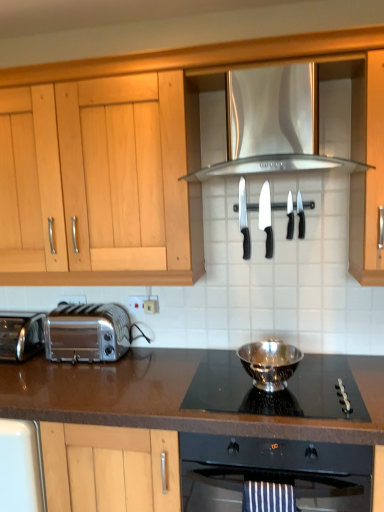
Question: From the image's perspective, is white plastic electric outlet at lower center, positioned as the first electric outlet in right-to-left order, below black plastic knife at center, the second knife viewed from the left?

Choices:
 (A) no
 (B) yes

Answer: (B)

Question: Are white plastic electric outlet at lower center, which appears as the 1th electric outlet when viewed from the front, and black plastic knife at center, the second knife viewed from the left, located far from each other?

Choices:
 (A) yes
 (B) no

Answer: (B)

Question: From a real-world perspective, is white plastic electric outlet at lower center, arranged as the second electric outlet when viewed from the left, on top of black plastic knife at center, the second knife viewed from the left?

Choices:
 (A) no
 (B) yes

Answer: (A)

Question: Considering the relative positions of white plastic electric outlet at lower center, the 2th electric outlet viewed from the back, and black plastic knife at center, the 3th knife from the right, in the image provided, is white plastic electric outlet at lower center, the 2th electric outlet viewed from the back, to the right of black plastic knife at center, the 3th knife from the right, from the viewer's perspective?

Choices:
 (A) yes
 (B) no

Answer: (B)

Question: Can you confirm if white plastic electric outlet at lower center, the 2th electric outlet viewed from the back, is thinner than black plastic knife at center, the 3th knife from the right?

Choices:
 (A) yes
 (B) no

Answer: (A)

Question: Considering the positions of silver metallic bowl at center and polished stainless steel bowl at center in the image, is silver metallic bowl at center bigger or smaller than polished stainless steel bowl at center?

Choices:
 (A) small
 (B) big

Answer: (B)

Question: In the image, is silver metallic bowl at center positioned in front of or behind polished stainless steel bowl at center?

Choices:
 (A) behind
 (B) front

Answer: (B)

Question: Is silver metallic bowl at center spatially inside polished stainless steel bowl at center, or outside of it?

Choices:
 (A) inside
 (B) outside

Answer: (B)

Question: In terms of width, does silver metallic bowl at center look wider or thinner when compared to polished stainless steel bowl at center?

Choices:
 (A) wide
 (B) thin

Answer: (A)

Question: Considering the relative positions of white plastic electric outlet at center, the first electric outlet in the back-to-front sequence, and silver metallic toaster at lower left, which is counted as the 2th toaster, starting from the right, in the image provided, is white plastic electric outlet at center, the first electric outlet in the back-to-front sequence, to the left or to the right of silver metallic toaster at lower left, which is counted as the 2th toaster, starting from the right,?

Choices:
 (A) right
 (B) left

Answer: (A)

Question: Considering the positions of white plastic electric outlet at center, positioned as the 2th electric outlet in front-to-back order, and silver metallic toaster at lower left, which is counted as the 2th toaster, starting from the right, in the image, is white plastic electric outlet at center, positioned as the 2th electric outlet in front-to-back order, taller or shorter than silver metallic toaster at lower left, which is counted as the 2th toaster, starting from the right,?

Choices:
 (A) tall
 (B) short

Answer: (B)

Question: From the image's perspective, relative to silver metallic toaster at lower left, which appears as the first toaster when viewed from the left, is white plastic electric outlet at center, the first electric outlet in the back-to-front sequence, above or below?

Choices:
 (A) above
 (B) below

Answer: (A)

Question: From a real-world perspective, relative to silver metallic toaster at lower left, which is counted as the 2th toaster, starting from the right, is white plastic electric outlet at center, the first electric outlet in the back-to-front sequence, vertically above or below?

Choices:
 (A) below
 (B) above

Answer: (B)

Question: Considering the positions of shiny metallic toaster at left, arranged as the first toaster when viewed from the right, and silver metallic toaster at lower left, which appears as the first toaster when viewed from the left, in the image, is shiny metallic toaster at left, arranged as the first toaster when viewed from the right, taller or shorter than silver metallic toaster at lower left, which appears as the first toaster when viewed from the left,?

Choices:
 (A) tall
 (B) short

Answer: (A)

Question: Is shiny metallic toaster at left, arranged as the first toaster when viewed from the right, wider or thinner than silver metallic toaster at lower left, which appears as the first toaster when viewed from the left?

Choices:
 (A) wide
 (B) thin

Answer: (B)